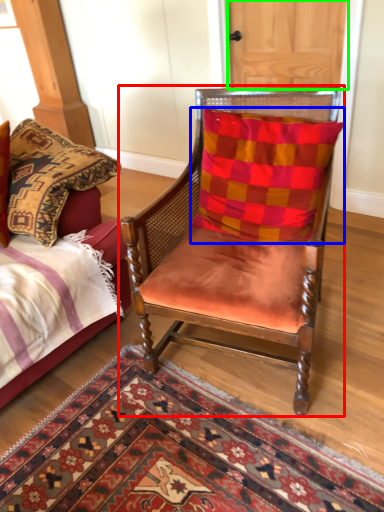
Question: Estimate the real-world distances between objects in this image. Which object is closer to chair (highlighted by a red box), pillow (highlighted by a blue box) or door (highlighted by a green box)?

Choices:
 (A) pillow
 (B) door

Answer: (A)